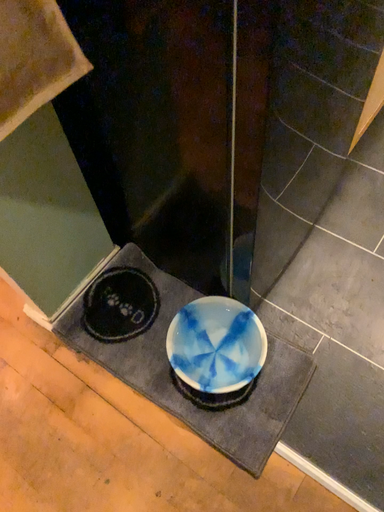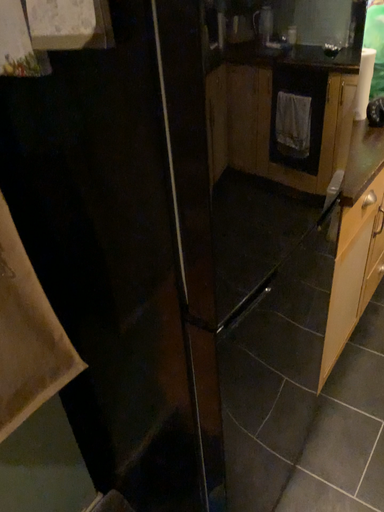
Question: Which way did the camera rotate in the video?

Choices:
 (A) rotated upward
 (B) rotated downward

Answer: (A)